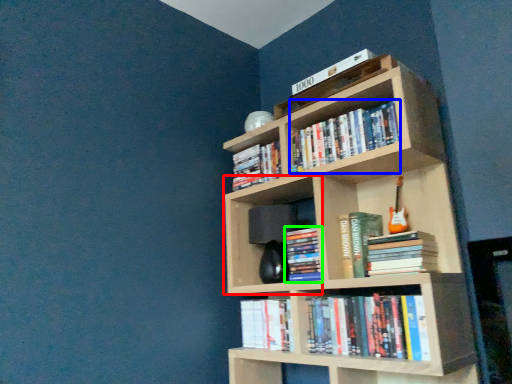
Question: Which object is positioned farthest from shelf (highlighted by a red box)? Select from book (highlighted by a blue box) and book (highlighted by a green box).

Choices:
 (A) book
 (B) book

Answer: (A)